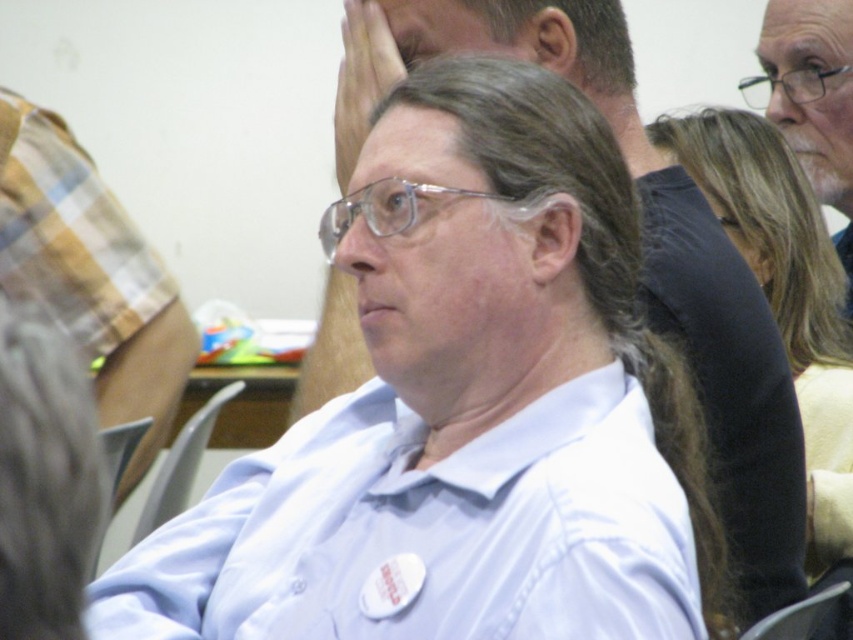
Is point (805, 285) more distant than point (775, 93)?

No, (805, 285) is in front of (775, 93).

Which is above, dark brown hair at upper right or white matte shirt at upper center?

white matte shirt at upper center

Which is behind, point (846, 493) or point (848, 36)?

Point (848, 36)

Locate an element on the screen. This screenshot has height=640, width=853. dark brown hair at upper right is located at coordinates (784, 291).

Is matte skin hand at upper center closer to camera compared to matte gray chair at lower left?

No, matte skin hand at upper center is behind matte gray chair at lower left.

Which is in front, point (341, 170) or point (138, 422)?

Point (341, 170) is more forward.

Where is `matte skin hand at upper center`? This screenshot has width=853, height=640. matte skin hand at upper center is located at coordinates (361, 80).

Does point (642, 170) come behind point (99, 516)?

Yes, it is.

Which of these two, white matte shirt at center or matte gray chair at lower left, stands taller?

Standing taller between the two is white matte shirt at center.

Is point (502, 12) closer to viewer compared to point (132, 444)?

Yes, it is.

This screenshot has width=853, height=640. What are the coordinates of `white matte shirt at center` in the screenshot? It's located at coord(668,276).